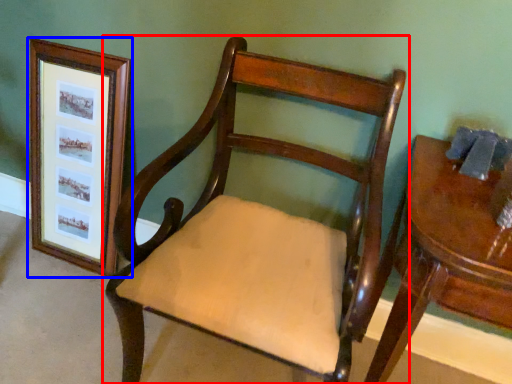
Question: Which object is further to the camera taking this photo, chair (highlighted by a red box) or picture frame (highlighted by a blue box)?

Choices:
 (A) chair
 (B) picture frame

Answer: (B)